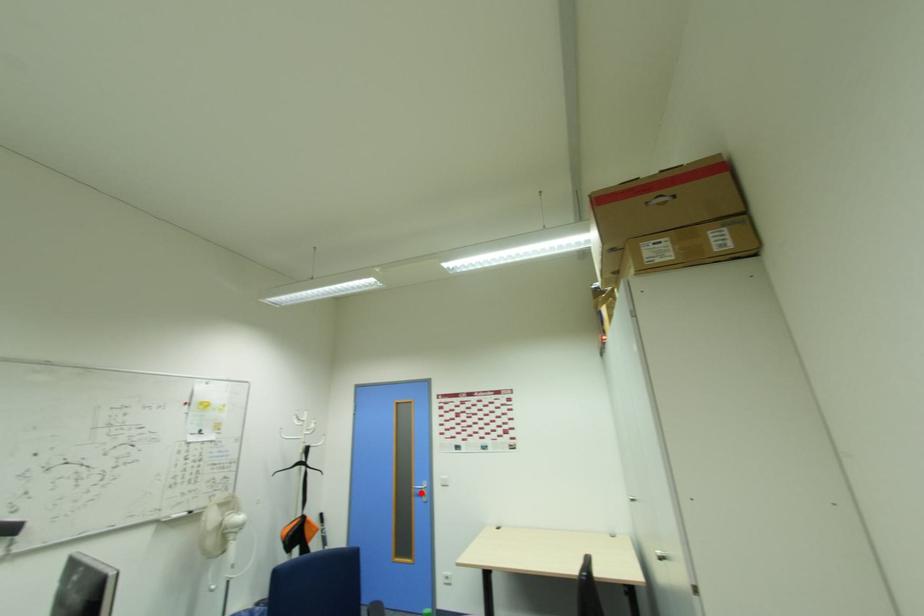
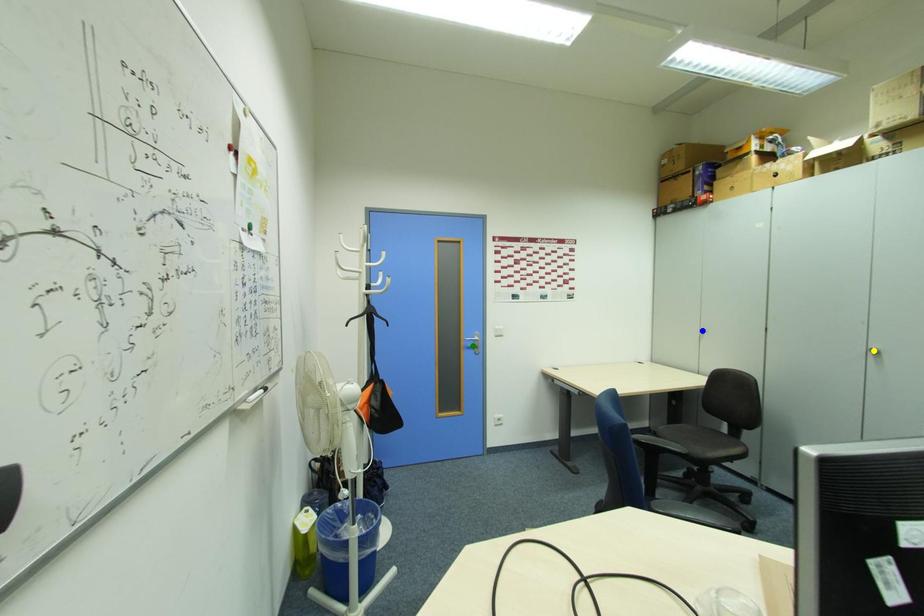
Question: I am providing you with two images of the same scene from different viewpoints. A red point is marked on the first image. You are given multiple points on the second image. Which mark in image 2 goes with the point in image 1?

Choices:
 (A) green point
 (B) yellow point
 (C) blue point

Answer: (A)